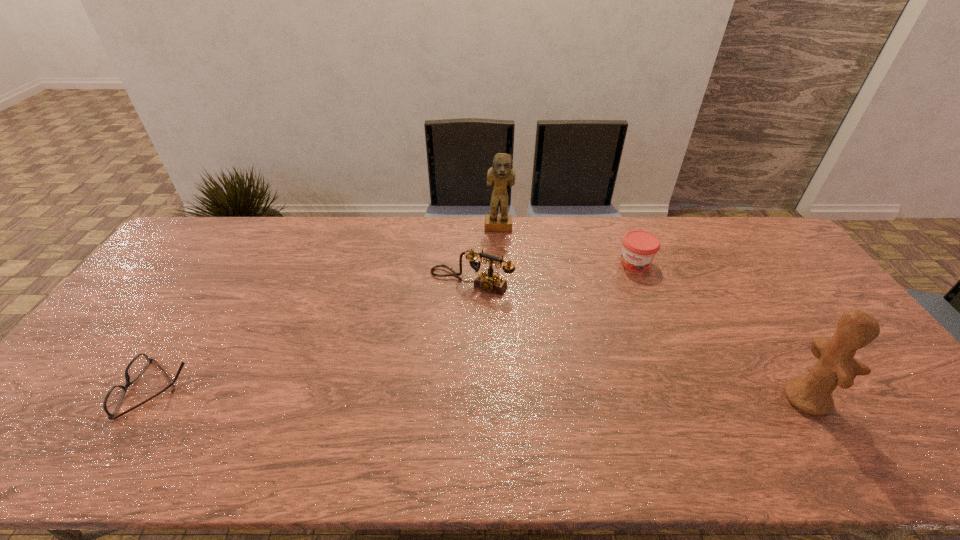
This screenshot has height=540, width=960. Find the location of `the leftmost object`. the leftmost object is located at coordinates (113, 399).

Identify the location of spectacles. (113, 399).

Identify the location of the right figurine. (836, 366).

Identify the location of the rightmost object. (836, 366).

Where is `the left figurine`? The height and width of the screenshot is (540, 960). the left figurine is located at coordinates (501, 174).

At what (x,y) coordinates should I click in order to perform the action: click on the farthest object. Please return your answer as a coordinate pair (x, y). The image size is (960, 540). Looking at the image, I should click on (501, 174).

The width and height of the screenshot is (960, 540). In order to click on the second shortest object in this screenshot , I will do `click(639, 248)`.

The height and width of the screenshot is (540, 960). Identify the location of the second object from right to left. (639, 248).

I want to click on telephone, so click(489, 282).

Locate an element on the screen. The height and width of the screenshot is (540, 960). vacant space located 0.130m on the front-facing side of the spectacles is located at coordinates (75, 389).